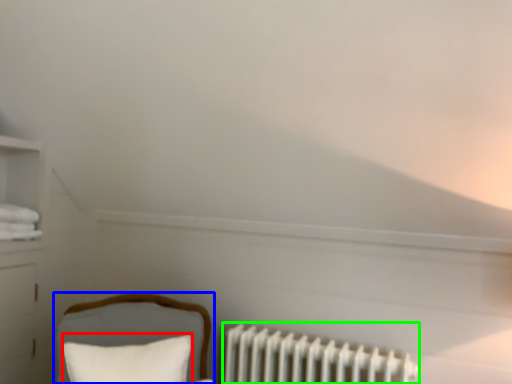
Question: Based on their relative distances, which object is nearer to pillow (highlighted by a red box)? Choose from furniture (highlighted by a blue box) and radiator (highlighted by a green box).

Choices:
 (A) furniture
 (B) radiator

Answer: (A)